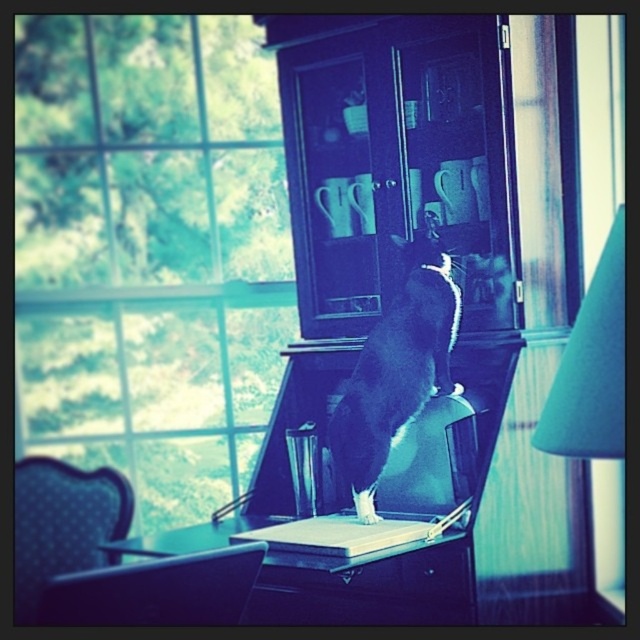
Question: Which object is closer to the camera taking this photo?

Choices:
 (A) black glossy laptop at center
 (B) blue dotted fabric chair at lower left
 (C) smooth wooden table at center

Answer: (C)

Question: In this image, where is smooth wooden table at center located relative to black glossy laptop at center?

Choices:
 (A) below
 (B) above

Answer: (A)

Question: Based on their relative distances, which object is nearer to the transparent glass window at upper left?

Choices:
 (A) smooth wooden table at center
 (B) black fur cat at center
 (C) teal fabric lampshade at right

Answer: (B)

Question: Does transparent glass window at upper left appear over black fur cat at center?

Choices:
 (A) no
 (B) yes

Answer: (B)

Question: Among these objects, which one is nearest to the camera?

Choices:
 (A) matte black chair at lower left
 (B) smooth wooden table at center

Answer: (A)

Question: Does transparent glass window at upper left appear under black glossy laptop at center?

Choices:
 (A) no
 (B) yes

Answer: (A)